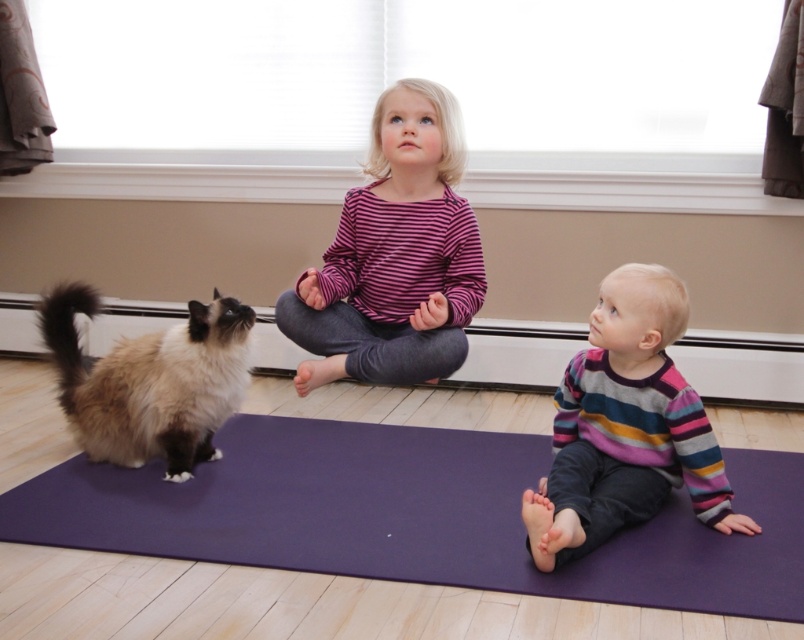
Is striped cotton shirt at center thinner than striped sweater at lower right?

Correct, striped cotton shirt at center's width is less than striped sweater at lower right's.

Consider the image. Can you confirm if striped cotton shirt at center is wider than striped sweater at lower right?

In fact, striped cotton shirt at center might be narrower than striped sweater at lower right.

You are a GUI agent. You are given a task and a screenshot of the screen. Output one action in this format:
    pyautogui.click(x=<x>, y=<y>)
    Task: Click on the striped cotton shirt at center
    Image resolution: width=804 pixels, height=640 pixels.
    Given the screenshot: What is the action you would take?
    pyautogui.click(x=394, y=256)

Does striped cotton shirt at center appear under soft cream fur cat at lower left?

No, striped cotton shirt at center is not below soft cream fur cat at lower left.

You are a GUI agent. You are given a task and a screenshot of the screen. Output one action in this format:
    pyautogui.click(x=<x>, y=<y>)
    Task: Click on the striped cotton shirt at center
    
    Given the screenshot: What is the action you would take?
    pyautogui.click(x=394, y=256)

Is purple yoga mat at lower center thinner than striped sweater at lower right?

No, purple yoga mat at lower center is not thinner than striped sweater at lower right.

Is purple yoga mat at lower center smaller than striped sweater at lower right?

No, purple yoga mat at lower center is not smaller than striped sweater at lower right.

Find the location of a particular element. purple yoga mat at lower center is located at coordinates (417, 516).